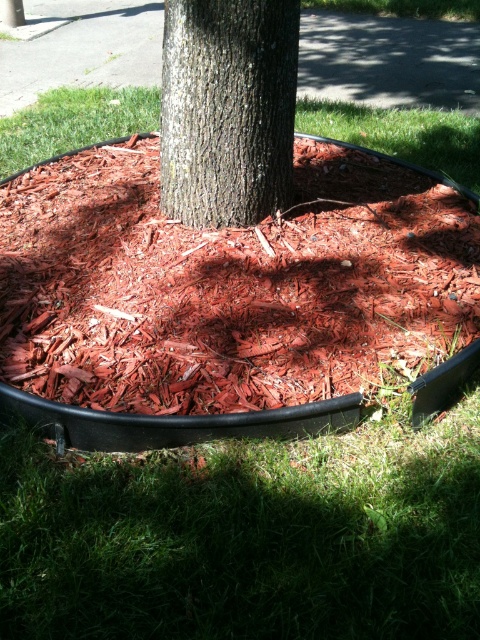
You are a gardener standing at the point with coordinates (224, 298) in the image. You want to place a small decorative rock here. What material will the rock be placed on?

The point at coordinates (224, 298) is covered with red mulch at center, so placing the rock there will place it on the red mulch at center.